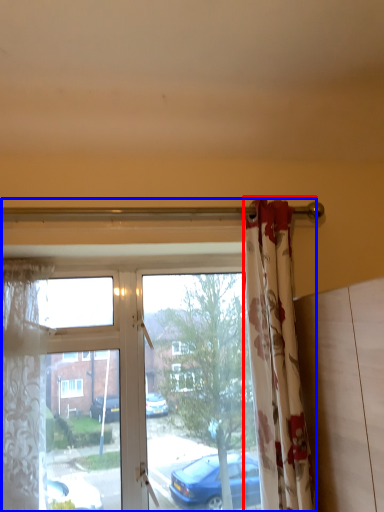
Question: Which of the following is the closest to the observer, curtain (highlighted by a red box) or window (highlighted by a blue box)?

Choices:
 (A) curtain
 (B) window

Answer: (A)